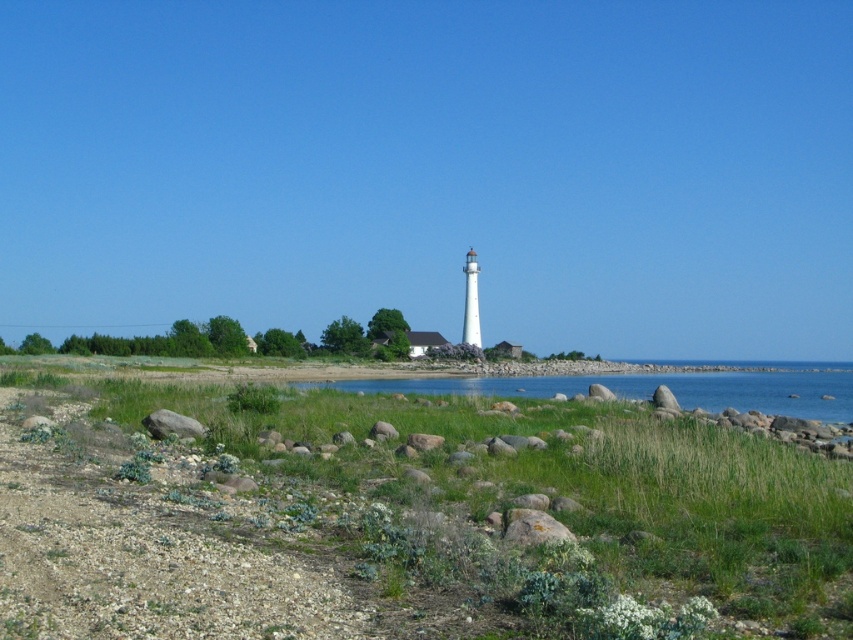
Is blue water at center in front of brown rock at lower center?

No, blue water at center is further to the viewer.

Is blue water at center smaller than brown rock at lower center?

No.

What do you see at coordinates (651, 388) in the screenshot? Image resolution: width=853 pixels, height=640 pixels. I see `blue water at center` at bounding box center [651, 388].

Locate an element on the screen. This screenshot has height=640, width=853. blue water at center is located at coordinates (x=651, y=388).

Which is below, brown rock at lower center or gray rough rock at lower left?

gray rough rock at lower left is below.

Who is more forward, (564,525) or (144,417)?

Point (564,525) is in front.

The width and height of the screenshot is (853, 640). Find the location of `brown rock at lower center`. brown rock at lower center is located at coordinates (534, 528).

Is blue water at center thinner than gray rough rock at lower left?

In fact, blue water at center might be wider than gray rough rock at lower left.

Can you confirm if blue water at center is positioned to the right of gray rough rock at lower left?

Indeed, blue water at center is positioned on the right side of gray rough rock at lower left.

Is point (764, 384) farther from viewer compared to point (186, 420)?

Yes, point (764, 384) is farther from viewer.

Identify the location of blue water at center. This screenshot has height=640, width=853. (651, 388).